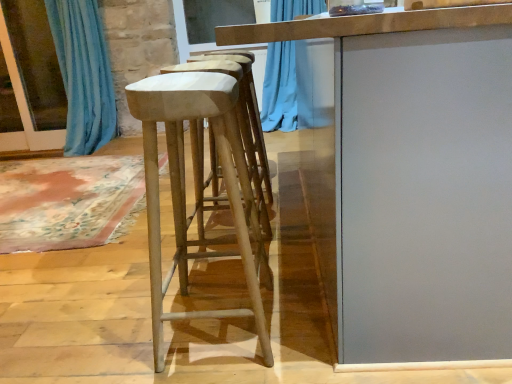
Question: From the image's perspective, is light brown wood stool at center located beneath smooth gray table at center?

Choices:
 (A) no
 (B) yes

Answer: (B)

Question: Considering the relative sizes of light brown wood stool at center and smooth gray table at center in the image provided, is light brown wood stool at center bigger than smooth gray table at center?

Choices:
 (A) yes
 (B) no

Answer: (B)

Question: Considering the relative positions of light brown wood stool at center and smooth gray table at center in the image provided, is light brown wood stool at center to the left of smooth gray table at center from the viewer's perspective?

Choices:
 (A) yes
 (B) no

Answer: (A)

Question: Is light brown wood stool at center beside smooth gray table at center?

Choices:
 (A) yes
 (B) no

Answer: (B)

Question: Is light brown wood stool at center not inside smooth gray table at center?

Choices:
 (A) no
 (B) yes

Answer: (B)

Question: Considering the relative sizes of light brown wood stool at center and smooth gray table at center in the image provided, is light brown wood stool at center smaller than smooth gray table at center?

Choices:
 (A) no
 (B) yes

Answer: (B)

Question: Is light brown wood stool at center positioned before blue fabric curtain at left?

Choices:
 (A) yes
 (B) no

Answer: (A)

Question: Is light brown wood stool at center with blue fabric curtain at left?

Choices:
 (A) yes
 (B) no

Answer: (B)

Question: Is light brown wood stool at center thinner than blue fabric curtain at left?

Choices:
 (A) yes
 (B) no

Answer: (B)

Question: Is light brown wood stool at center behind blue fabric curtain at left?

Choices:
 (A) no
 (B) yes

Answer: (A)

Question: Can you confirm if light brown wood stool at center is smaller than blue fabric curtain at left?

Choices:
 (A) no
 (B) yes

Answer: (A)

Question: Does light brown wood stool at center have a greater height compared to blue fabric curtain at left?

Choices:
 (A) yes
 (B) no

Answer: (B)

Question: From the image's perspective, is smooth gray table at center below blue fabric curtain at left?

Choices:
 (A) no
 (B) yes

Answer: (B)